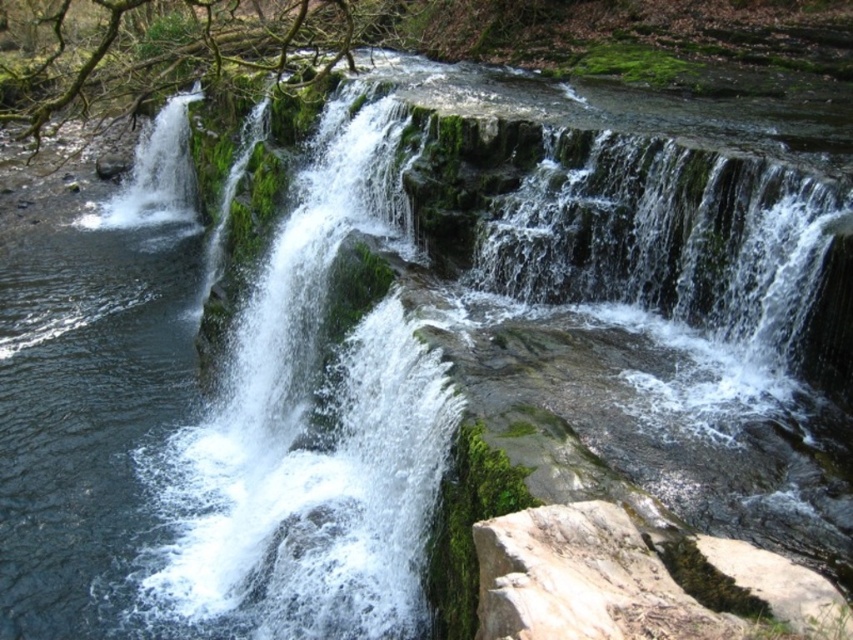
You are standing at the edge of the waterfall and see the white frothy water at left and the gray rough rock at lower right. Which object is closer to you?

The white frothy water at left is closer to you because it is further to the viewer than the gray rough rock at lower right.

You are a hiker standing at the edge of the waterfall. You notice the white frothy water at left and the gray rough rock at lower right. Which object is located higher up in the waterfall structure?

The white frothy water at left is positioned over the gray rough rock at lower right, meaning it is higher up in the waterfall structure.